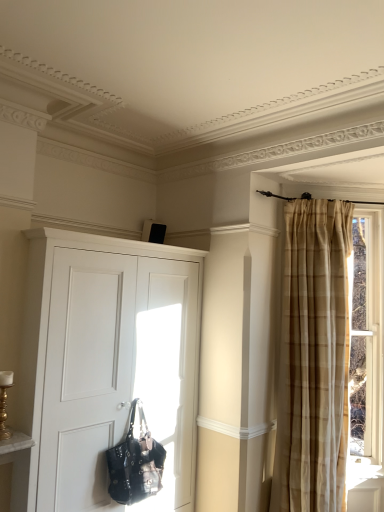
Question: Would you say white matte cupboard at center is inside or outside shiny black leather handbag at lower left?

Choices:
 (A) inside
 (B) outside

Answer: (B)

Question: From a real-world perspective, is white matte cupboard at center above or below shiny black leather handbag at lower left?

Choices:
 (A) above
 (B) below

Answer: (A)

Question: Estimate the real-world distances between objects in this image. Which object is closer to the white matte cupboard at center?

Choices:
 (A) shiny black leather handbag at lower left
 (B) brown plaid curtain at right

Answer: (A)

Question: Considering the real-world distances, which object is closest to the shiny black leather handbag at lower left?

Choices:
 (A) white matte cupboard at center
 (B) brown plaid curtain at right

Answer: (A)